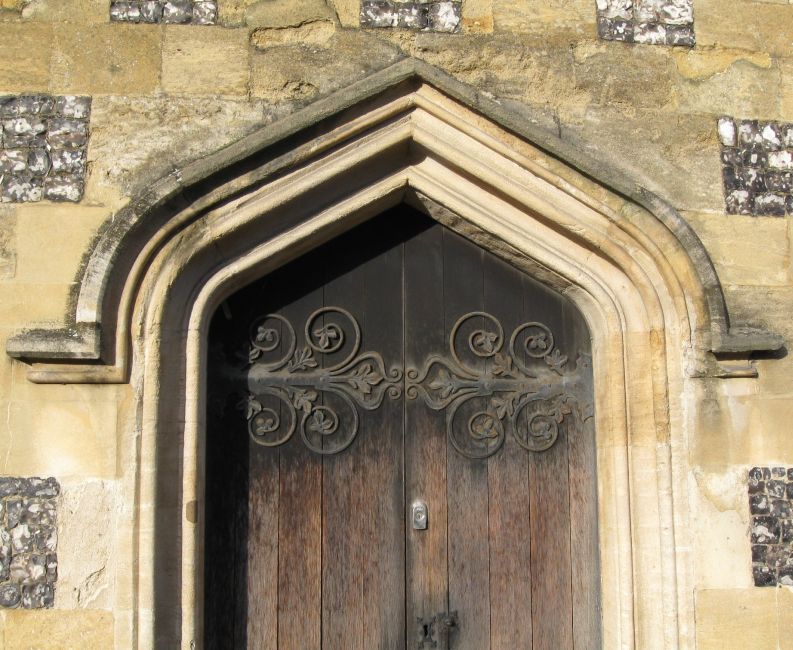
Image resolution: width=793 pixels, height=650 pixels. What are the coordinates of `point on the top middle of the doors` in the screenshot? It's located at (401, 210).